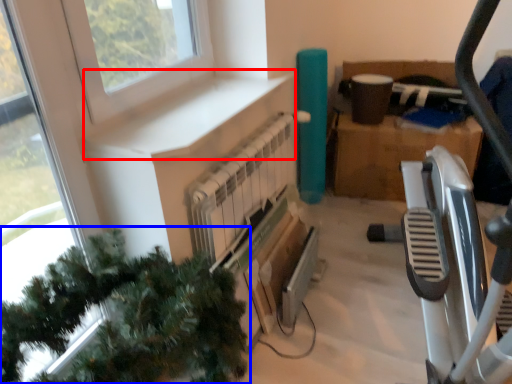
Question: Which point is further to the camera, window sill (highlighted by a red box) or christmas tree (highlighted by a blue box)?

Choices:
 (A) window sill
 (B) christmas tree

Answer: (A)